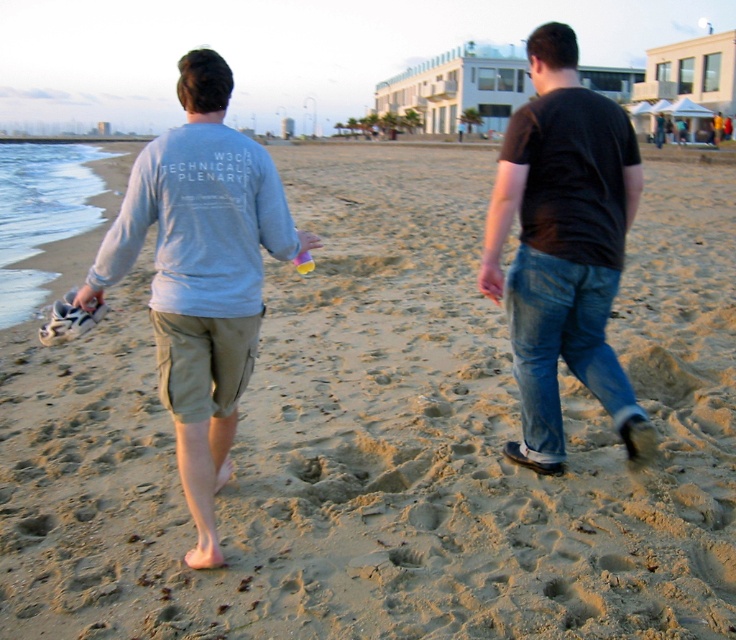
Question: From the image, what is the correct spatial relationship of light gray cotton shirt at left in relation to black cotton shirt at right?

Choices:
 (A) above
 (B) below

Answer: (B)

Question: Is light gray cotton shirt at left to the right of matte black t-shirt at upper right from the viewer's perspective?

Choices:
 (A) yes
 (B) no

Answer: (B)

Question: Which of these objects is positioned closest to the black cotton shirt at right?

Choices:
 (A) matte black t-shirt at upper right
 (B) light gray cotton shirt at left

Answer: (B)

Question: Which object is the closest to the light gray cotton shirt at left?

Choices:
 (A) black cotton shirt at right
 (B) matte black t-shirt at upper right

Answer: (A)

Question: Is black cotton shirt at right positioned at the back of matte black t-shirt at upper right?

Choices:
 (A) yes
 (B) no

Answer: (B)

Question: Which is farther from the light gray cotton shirt at left?

Choices:
 (A) black cotton shirt at right
 (B) matte black t-shirt at upper right

Answer: (B)